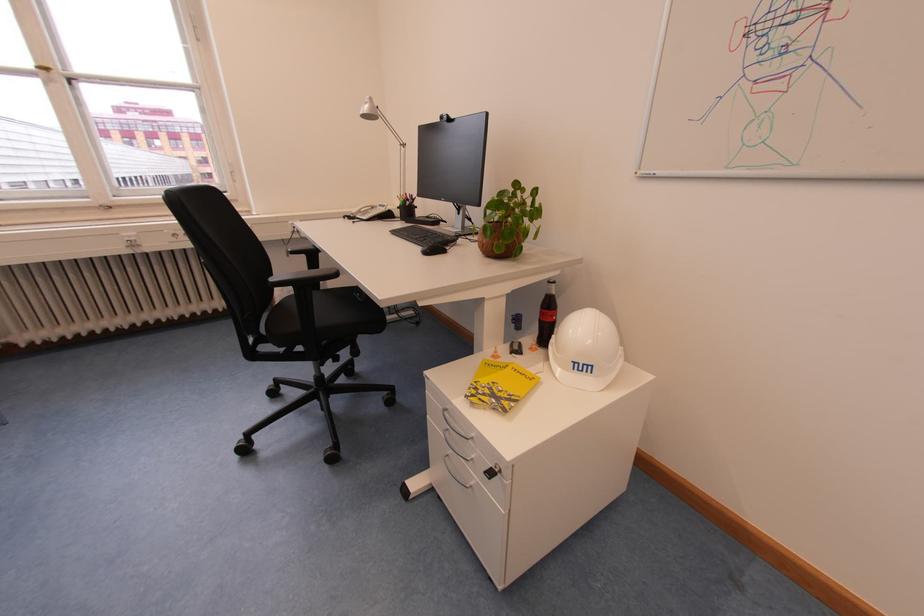
Where is `black computer mouse`? This screenshot has width=924, height=616. black computer mouse is located at coordinates (432, 249).